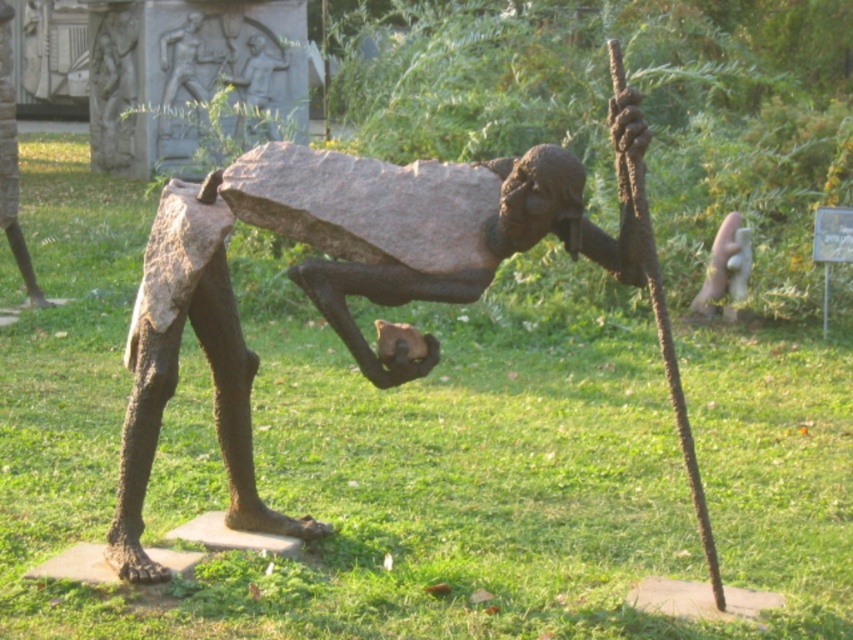
You are a tour guide leading a group and want to ensure everyone can see both the rusty metal statue at center and the bronze statue at left clearly. If the viewing distance required for each statue is 5 meters, can the group stand at a single point to view both statues without moving?

The rusty metal statue at center and bronze statue at left are 6.40 meters apart from each other. Since the required viewing distance for each is 5 meters, the group would need to stand at a point where they are within 5 meters of both statues. However, the distance between the statues is greater than 10 meters combined viewing distance, so it is impossible to find a single spot that is within 5 meters of both. Therefore, the group cannot stand at one point to view both clearly without moving.

From the picture: You are an art student observing two bronze statues in a park. The first is the bronze statue at left, and the second is the bronze statue at upper center. Based on their positions and sizes, which one do you think is closer to you?

The bronze statue at upper center is closer to you because it is much shorter than the bronze statue at left, indicating it is nearer in the visual perspective.

You are standing at the center of the grassy area in the park. There is a bronze statue at left. Where is the bronze statue located relative to your position?

The bronze statue at left is located at point (12, 164) relative to your position.